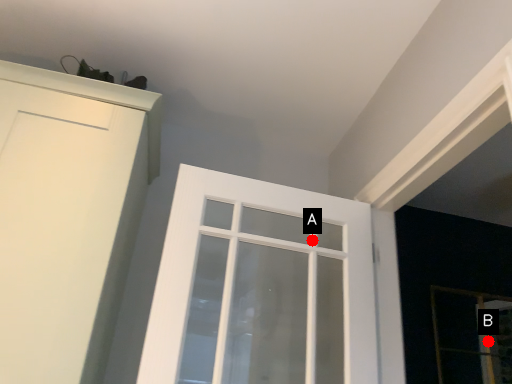
Question: Two points are circled on the image, labeled by A and B beside each circle. Among these points, which one is farthest from the camera?

Choices:
 (A) A is further
 (B) B is further

Answer: (B)